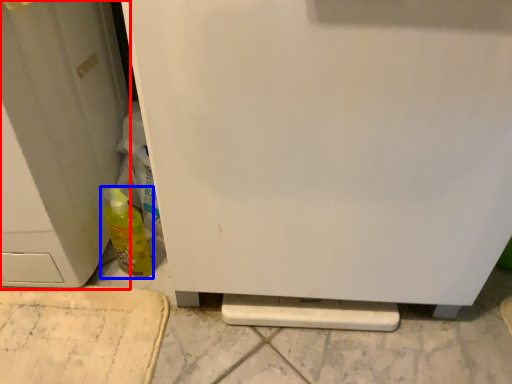
Question: Which of the following is the farthest to the observer, door (highlighted by a red box) or bottle (highlighted by a blue box)?

Choices:
 (A) door
 (B) bottle

Answer: (B)